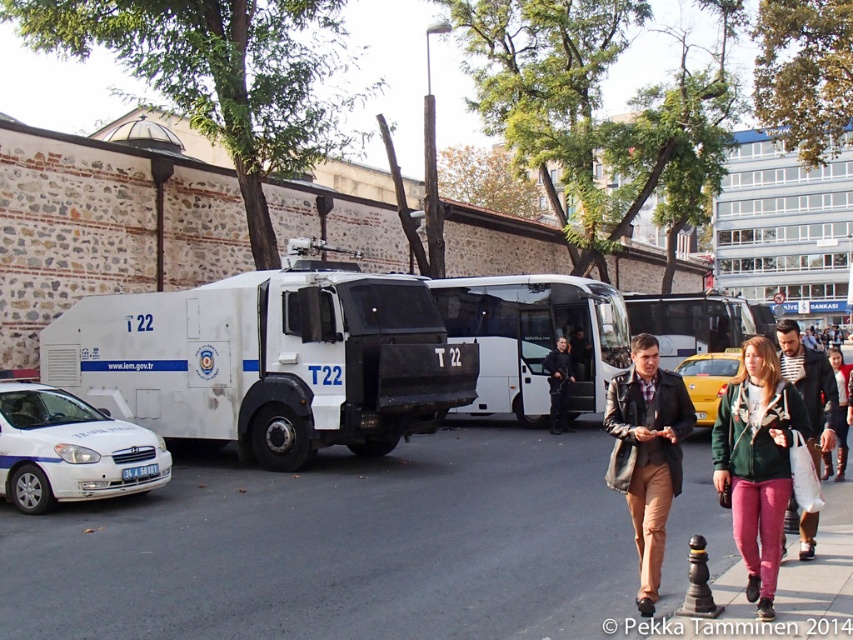
You are a delivery person needing to cross the street between the white matte bus at center and the white glossy sedan at lower left. The road is 10 meters wide. Can you safely cross without needing to walk into the road?

The distance between the white matte bus at center and the white glossy sedan at lower left is 9.88 meters. Since the road is 10 meters wide, the gap between the two vehicles is slightly shorter than the road width, so you can safely cross between them without needing to walk into the road.

You are a pedestrian standing at the crosswalk in the urban street scene. You see the white matte bus at center and the white glossy sedan at lower left. Which vehicle is positioned to the right side from your perspective?

The white matte bus at center is positioned to the right side of the white glossy sedan at lower left, so from your perspective as a pedestrian at the crosswalk, the white matte bus at center is on the right.